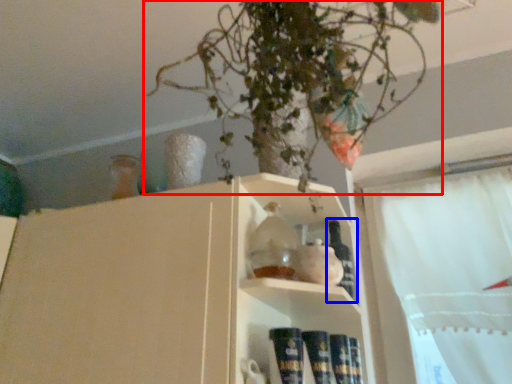
Question: Which of the following is the closest to the observer, houseplant (highlighted by a red box) or bottle (highlighted by a blue box)?

Choices:
 (A) houseplant
 (B) bottle

Answer: (A)